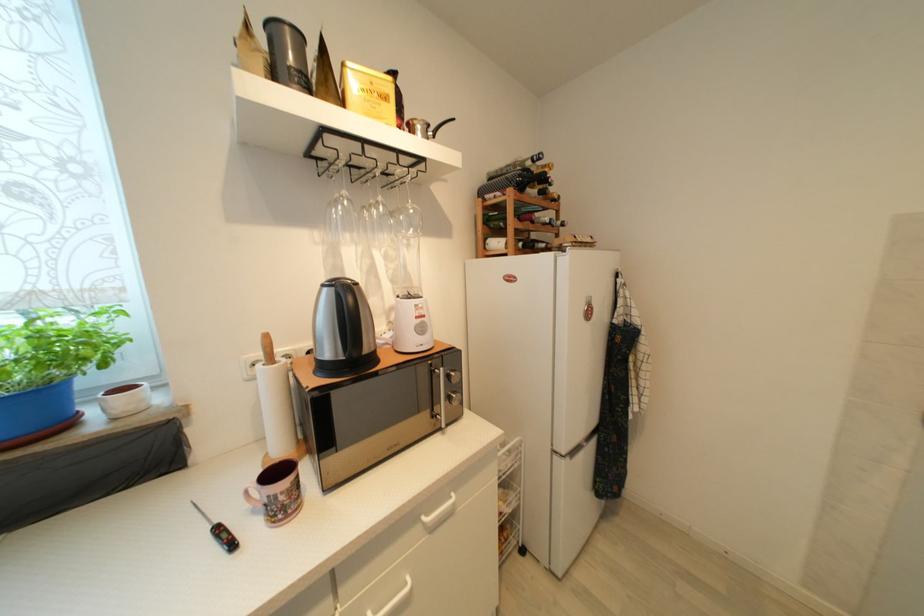
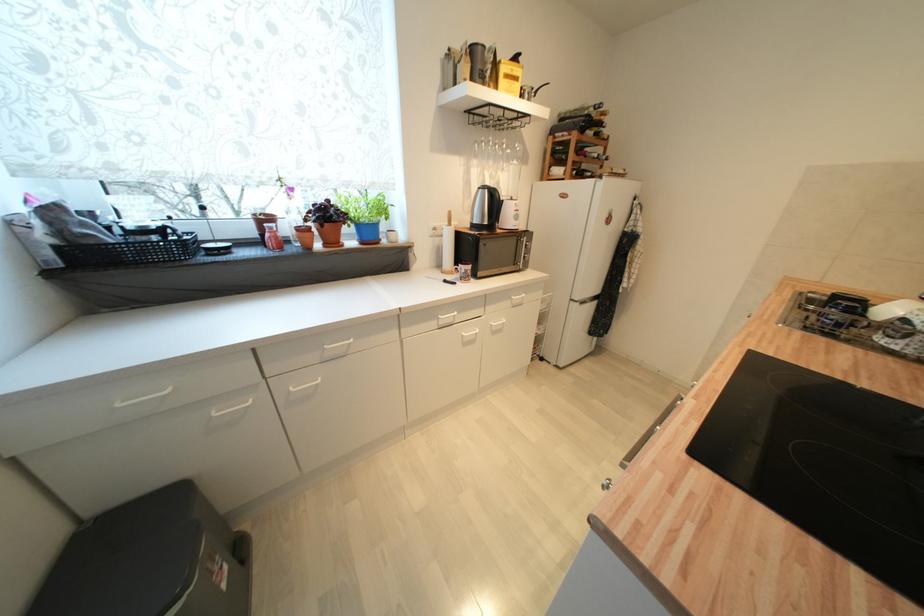
Locate, in the second image, the point that corresponds to (383,206) in the first image.

(507, 146)